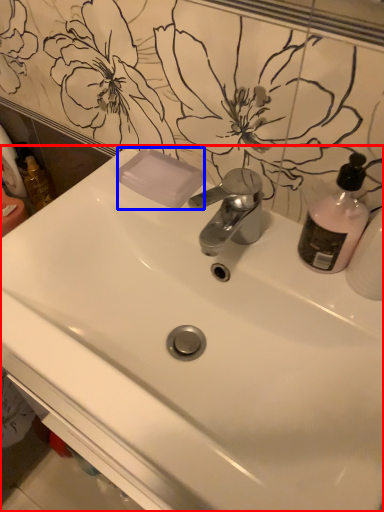
Question: Among these objects, which one is nearest to the camera, sink (highlighted by a red box) or soap (highlighted by a blue box)?

Choices:
 (A) sink
 (B) soap

Answer: (A)